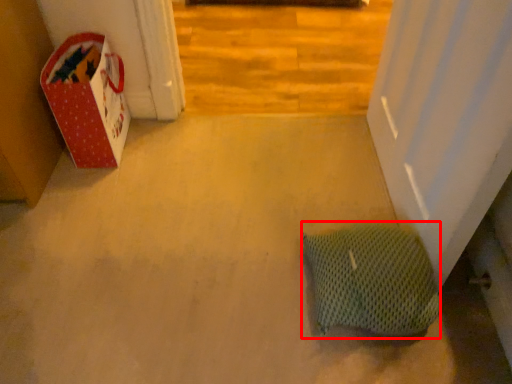
Question: From the image's perspective, considering the relative positions of pillow (annotated by the red box) and cardboard box in the image provided, where is pillow (annotated by the red box) located with respect to the staircase?

Choices:
 (A) below
 (B) above

Answer: (A)